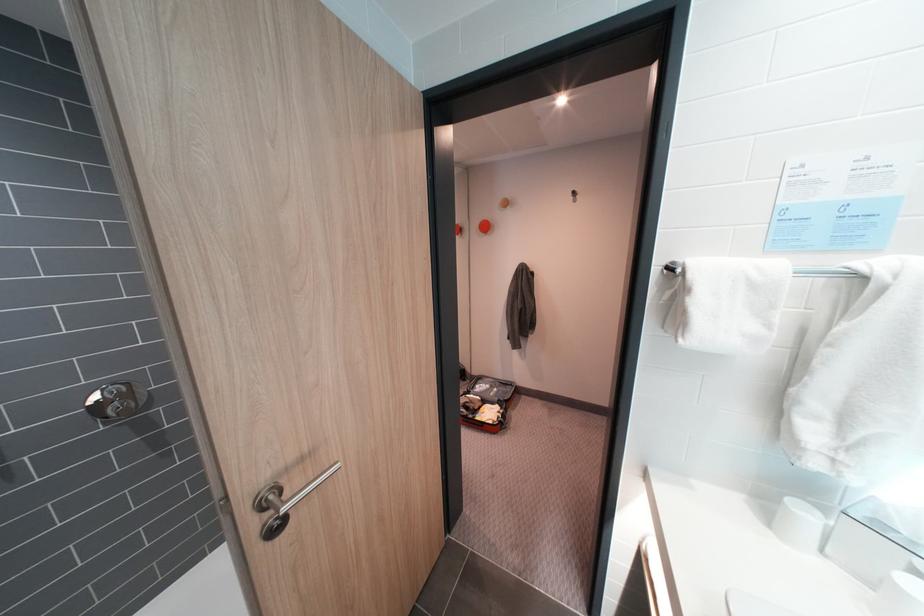
Where would you turn the chrome shower knob? Please return your answer as a coordinate pair (x, y).

(112, 402)